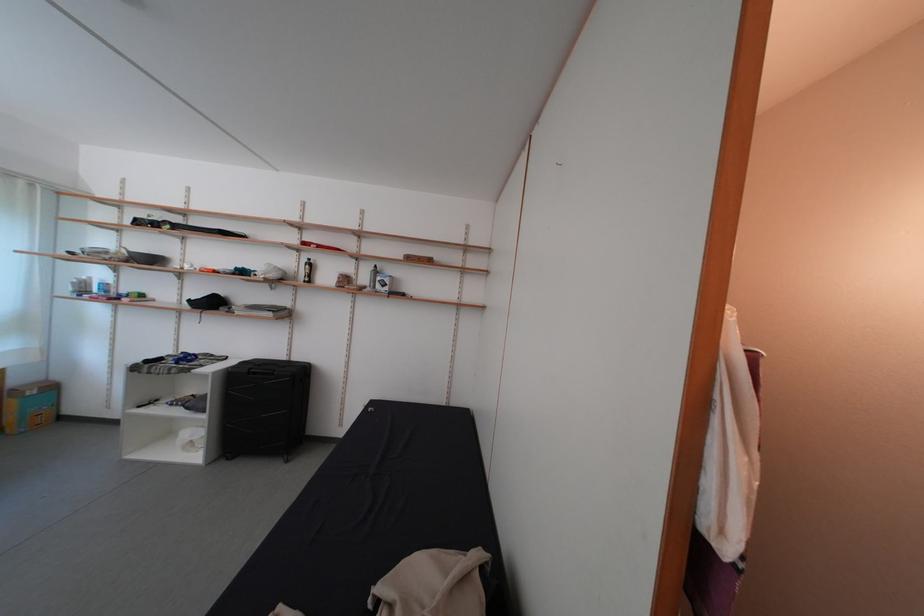
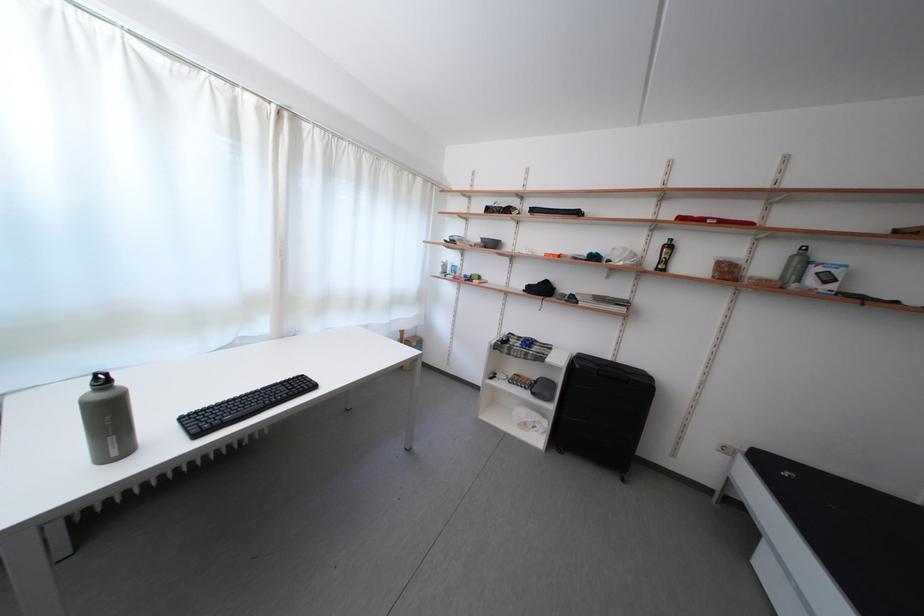
The point at (293, 363) is marked in the first image. Where is the corresponding point in the second image?

(617, 363)